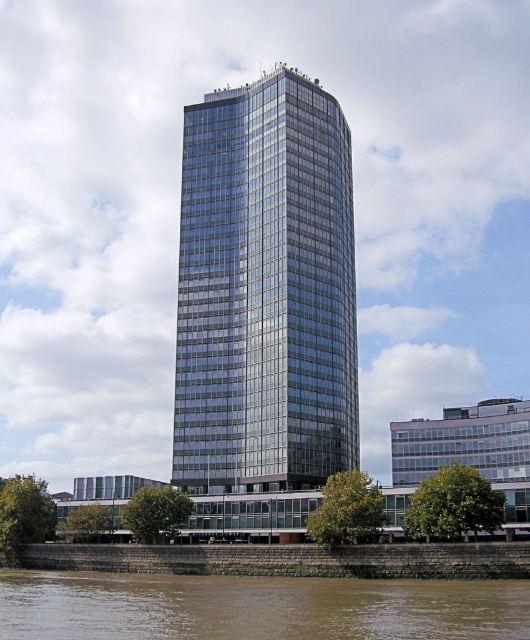
Describe the element at coordinates (255, 605) in the screenshot. I see `brown sedimentary rock at lower center` at that location.

You are a GUI agent. You are given a task and a screenshot of the screen. Output one action in this format:
    pyautogui.click(x=<x>, y=<y>)
    Task: Click on the brown sedimentary rock at lower center
    The width and height of the screenshot is (530, 640).
    Given the screenshot: What is the action you would take?
    pyautogui.click(x=255, y=605)

Measure the distance between point (295, 330) and camera.

Point (295, 330) and camera are 86.93 meters apart from each other.

Can you confirm if glassy metallic tower at center is positioned below brown stone wall at lower left?

No, glassy metallic tower at center is not below brown stone wall at lower left.

You are a GUI agent. You are given a task and a screenshot of the screen. Output one action in this format:
    pyautogui.click(x=<x>, y=<y>)
    Task: Click on the glassy metallic tower at center
    
    Given the screenshot: What is the action you would take?
    tap(266, 291)

Where is `glassy metallic tower at center`? Image resolution: width=530 pixels, height=640 pixels. glassy metallic tower at center is located at coordinates (266, 291).

Can you confirm if glassy metallic tower at center is bigger than brown sedimentary rock at lower center?

Indeed, glassy metallic tower at center has a larger size compared to brown sedimentary rock at lower center.

Identify the location of glassy metallic tower at center. (266, 291).